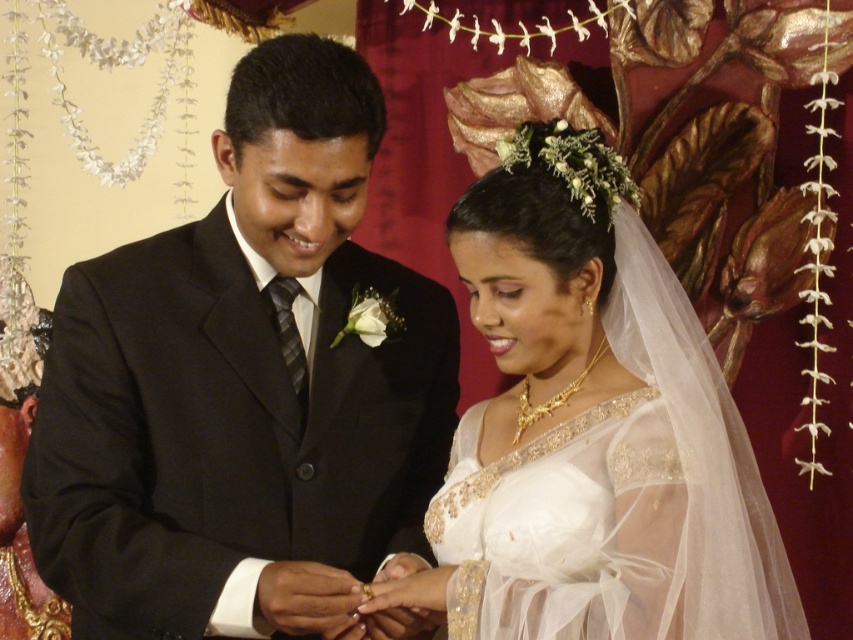
You are a photographer at a wedding and need to capture the couple exchanging rings. You see the white sheer dress at center and the white sheer fabric dress at center. Which dress is positioned to the left of the other?

The white sheer dress at center is positioned to the left of the white sheer fabric dress at center.

You are a photographer at the wedding and need to capture the couple exchanging rings. The white sheer dress at center and the white sheer fabric dress at center are both part of the scene. Which dress has a wider silhouette?

The white sheer dress at center has a wider silhouette than the white sheer fabric dress at center according to the description.

You are a photographer trying to capture the perfect shot of the wedding ceremony. You notice two points of interest in the scene marked as point 1 at coordinates point [254,269] and point 2 at coordinates point [567,444]. Which point is closer to you, the photographer?

Point [254,269] is closer to you because it is further to the viewer than point [567,444].